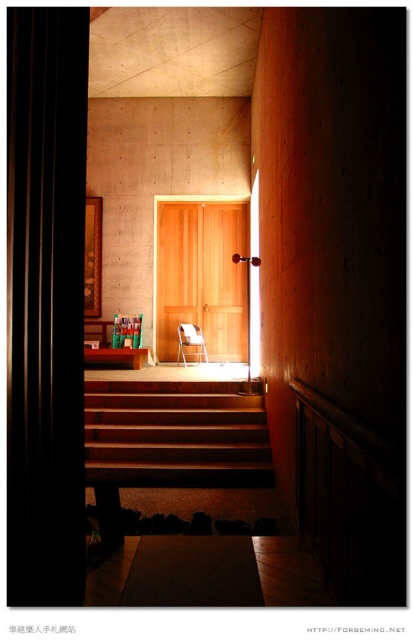
Is black matte curtain at left to the left of wooden door at center from the viewer's perspective?

Yes, black matte curtain at left is to the left of wooden door at center.

Image resolution: width=413 pixels, height=640 pixels. Describe the element at coordinates (45, 304) in the screenshot. I see `black matte curtain at left` at that location.

This screenshot has width=413, height=640. I want to click on black matte curtain at left, so click(x=45, y=304).

Is black matte curtain at left thinner than wooden stairs at center?

Indeed, black matte curtain at left has a lesser width compared to wooden stairs at center.

The height and width of the screenshot is (640, 413). What do you see at coordinates (45, 304) in the screenshot?
I see `black matte curtain at left` at bounding box center [45, 304].

Identify the location of black matte curtain at left. This screenshot has width=413, height=640. (45, 304).

Is wooden stairs at center thinner than wooden at center?

No, wooden stairs at center is not thinner than wooden at center.

Who is higher up, wooden stairs at center or wooden at center?

wooden at center is higher up.

Does point (168, 481) come closer to viewer compared to point (116, 352)?

Yes, point (168, 481) is in front of point (116, 352).

Image resolution: width=413 pixels, height=640 pixels. Identify the location of wooden stairs at center. (175, 435).